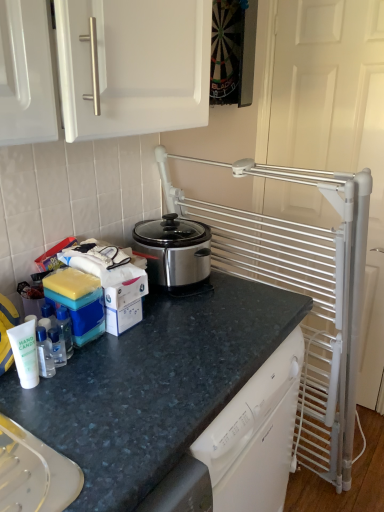
Where is `free point to the right of white matte hand sanitizer at lower left, the 1th bottle viewed from the front`? The width and height of the screenshot is (384, 512). free point to the right of white matte hand sanitizer at lower left, the 1th bottle viewed from the front is located at coordinates (82, 406).